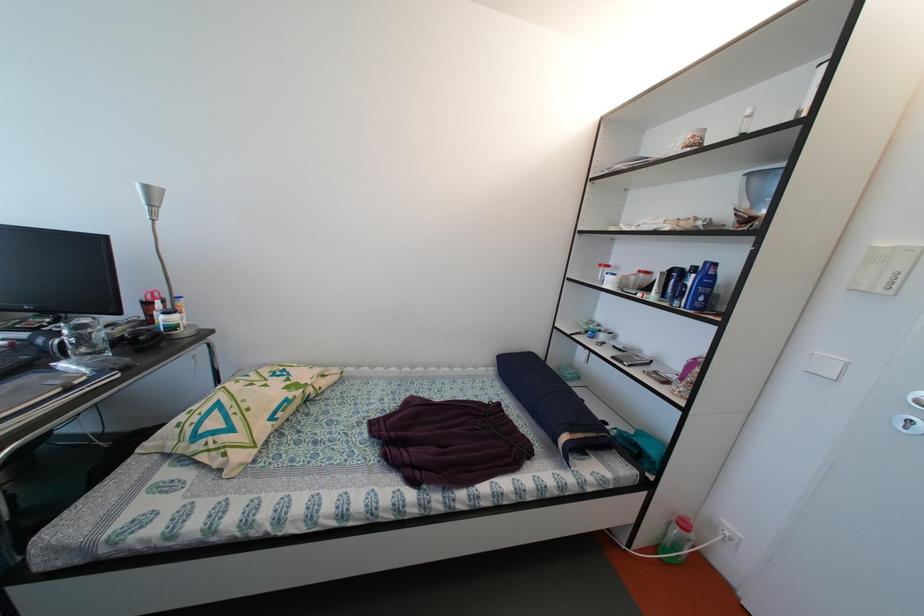
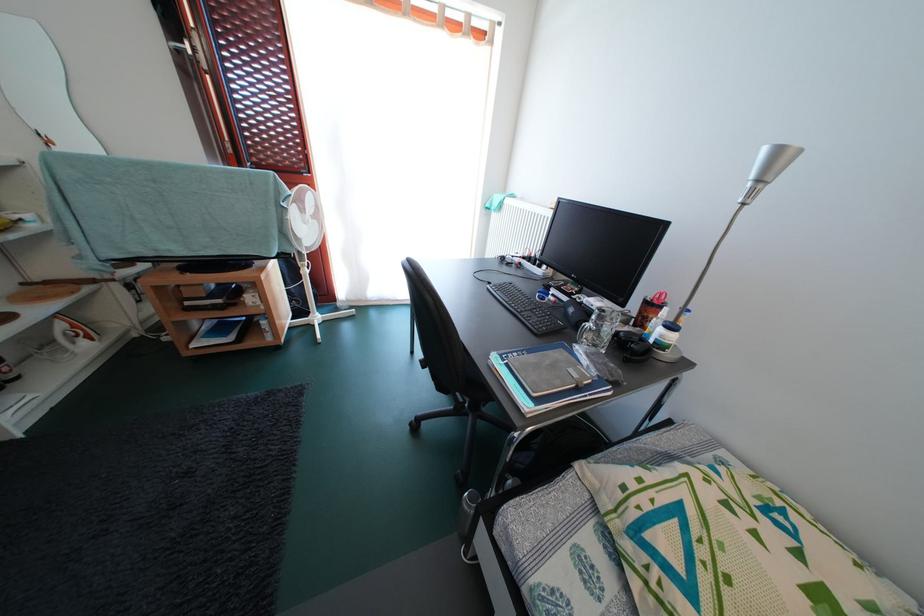
Where in the second image is the point corresponding to point 155,310 from the first image?

(658, 310)